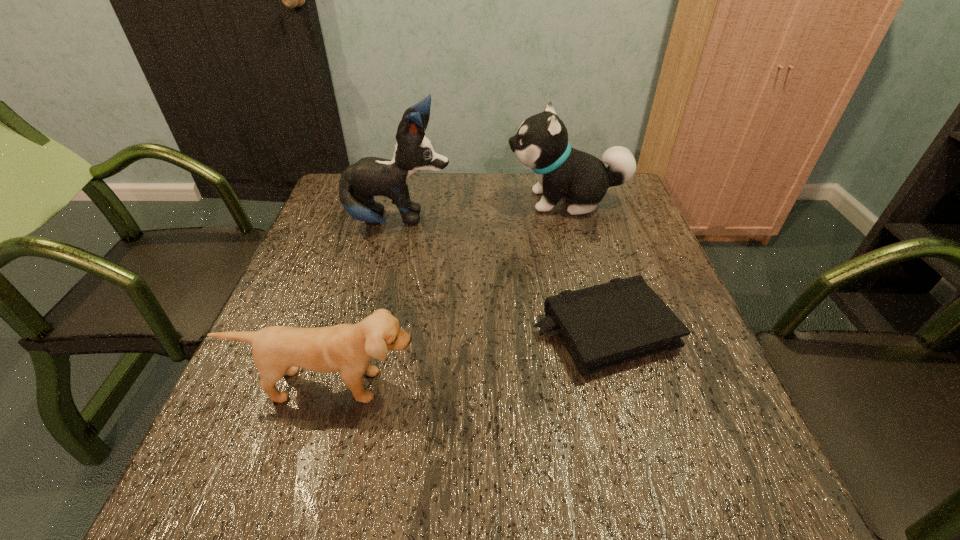
The height and width of the screenshot is (540, 960). I want to click on free space located on the left side of the third tallest object, so click(x=311, y=444).

Locate an element on the screen. The height and width of the screenshot is (540, 960). vacant space located 0.370m on the left of the shortest object is located at coordinates (355, 331).

Where is `puppy at the right edge`? This screenshot has height=540, width=960. puppy at the right edge is located at coordinates (541, 143).

The height and width of the screenshot is (540, 960). I want to click on Bible present at the right edge, so click(602, 326).

At what (x,y) coordinates should I click in order to perform the action: click on object that is at the far left corner. Please return your answer as a coordinate pair (x, y). This screenshot has height=540, width=960. Looking at the image, I should click on (370, 176).

This screenshot has width=960, height=540. I want to click on object that is at the far right corner, so click(541, 143).

Where is `free space at the far edge`? The height and width of the screenshot is (540, 960). free space at the far edge is located at coordinates (516, 175).

Where is `vacant space at the near edge of the desktop`? The width and height of the screenshot is (960, 540). vacant space at the near edge of the desktop is located at coordinates (383, 460).

I want to click on vacant position at the left edge of the desktop, so click(x=307, y=410).

I want to click on vacant space at the right edge, so click(657, 428).